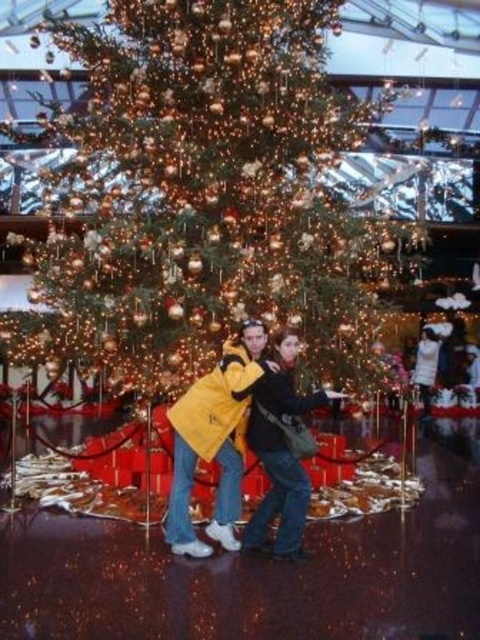
Question: Is shiny gold ornaments at center smaller than yellow matte jacket at center?

Choices:
 (A) no
 (B) yes

Answer: (A)

Question: Which of the following is the farthest from the observer?

Choices:
 (A) (172, 419)
 (B) (36, 291)

Answer: (B)

Question: Is shiny gold ornaments at center above yellow matte jacket at center?

Choices:
 (A) yes
 (B) no

Answer: (A)

Question: Is shiny gold ornaments at center to the right of yellow matte jacket at center from the viewer's perspective?

Choices:
 (A) yes
 (B) no

Answer: (B)

Question: Which of the following is the farthest from the observer?

Choices:
 (A) shiny gold ornaments at center
 (B) yellow matte jacket at center

Answer: (A)